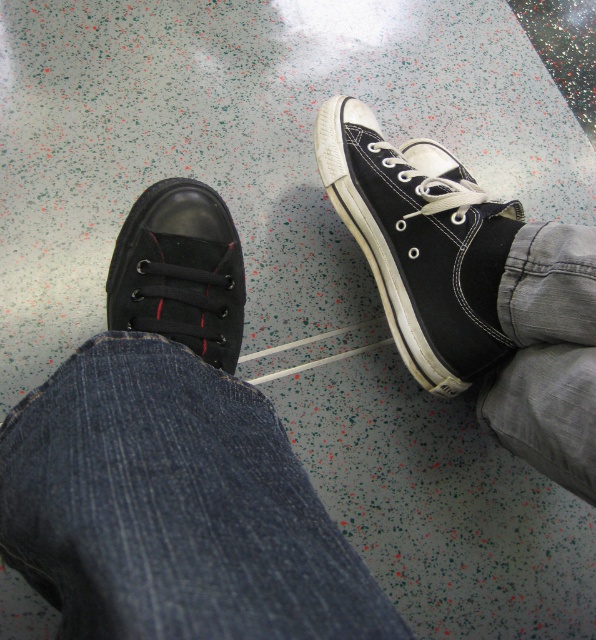
Question: Which point appears closest to the camera in this image?

Choices:
 (A) (452, 200)
 (B) (144, 205)

Answer: (B)

Question: In this image, where is matte canvas sneaker at upper center located relative to matte black shoe at lower left?

Choices:
 (A) above
 (B) below

Answer: (A)

Question: Does matte canvas sneaker at upper center come behind matte black shoe at lower left?

Choices:
 (A) yes
 (B) no

Answer: (A)

Question: Observing the image, what is the correct spatial positioning of matte canvas sneaker at upper center in reference to matte black shoe at lower left?

Choices:
 (A) left
 (B) right

Answer: (B)

Question: Which point appears farthest from the camera in this image?

Choices:
 (A) (185, 262)
 (B) (467, 301)

Answer: (B)

Question: Among these points, which one is nearest to the camera?

Choices:
 (A) (330, 141)
 (B) (173, 300)

Answer: (B)